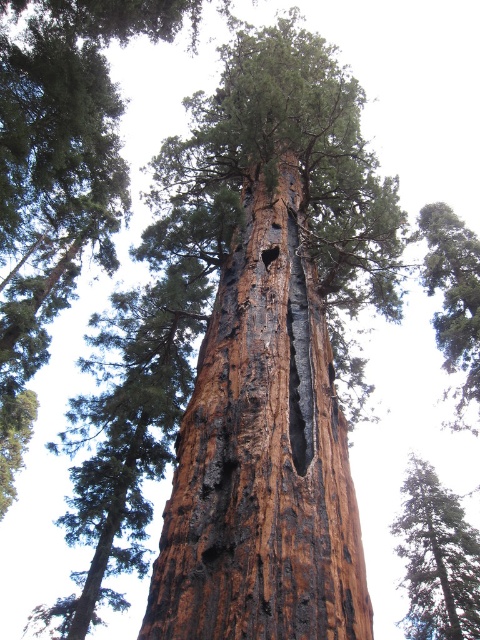
You are a park ranger assessing a tree and its health. You see the rough bark tree at center and the dark brown wood hole at center. Which object is bigger in size?

The rough bark tree at center is larger in size than the dark brown wood hole at center.

You are standing at the base of the giant sequoia tree and looking up. There are two points marked on the tree trunk. One is at coordinate point [468,330] and the other at point [272,250]. If you were to throw a small stone, which point would it hit first?

Point [272,250] would be hit first because it is closer to the base of the tree compared to point [468,330], which is located further up the trunk.